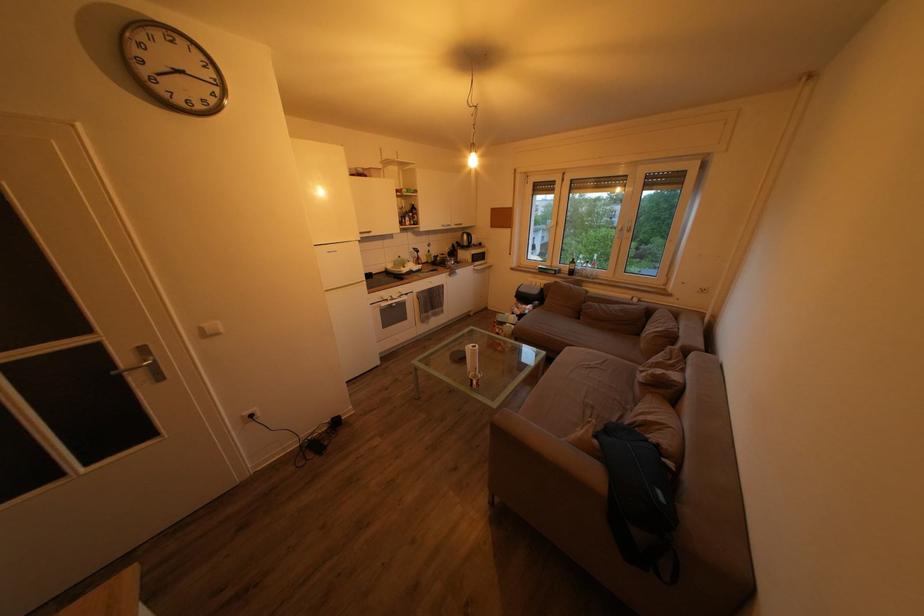
What do you see at coordinates (234, 490) in the screenshot?
I see `the refrigerator door handle` at bounding box center [234, 490].